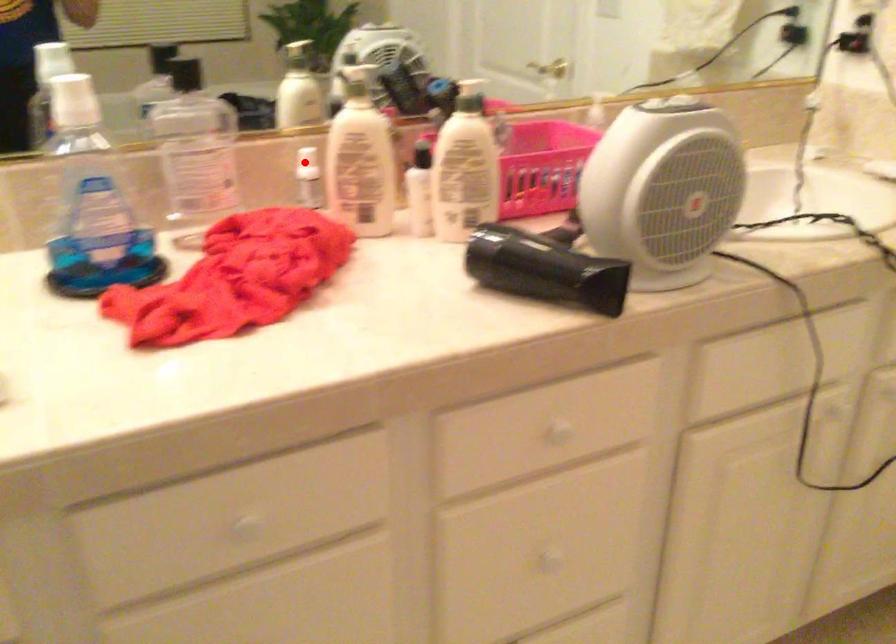
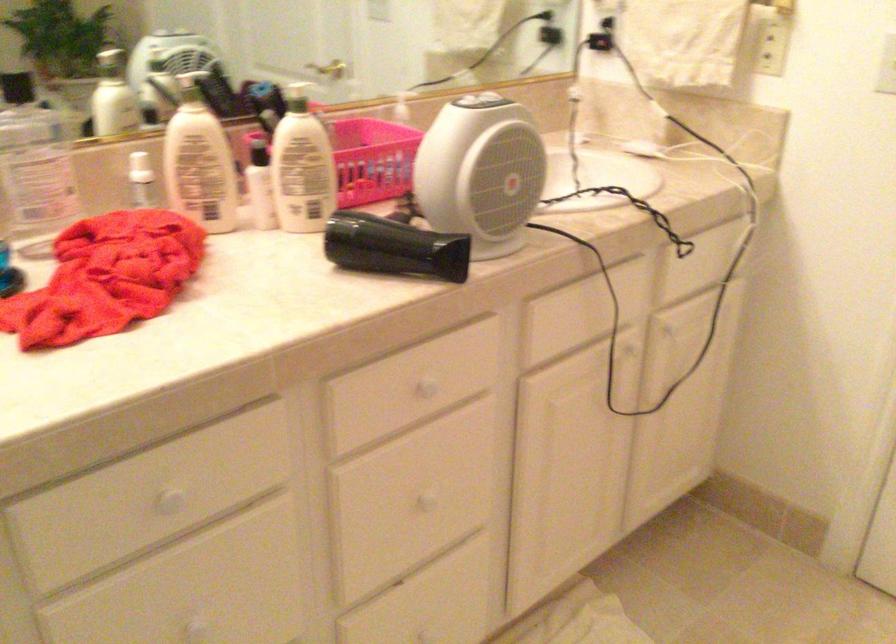
Where in the second image is the point corresponding to the highlighted location from the first image?

(140, 167)